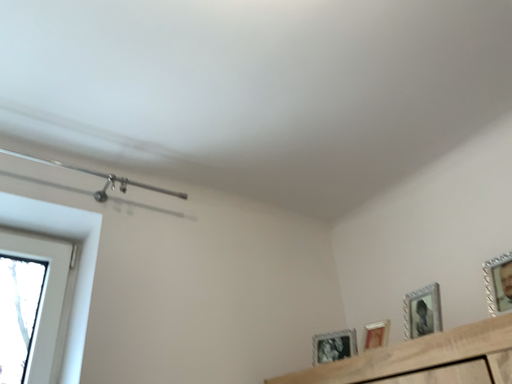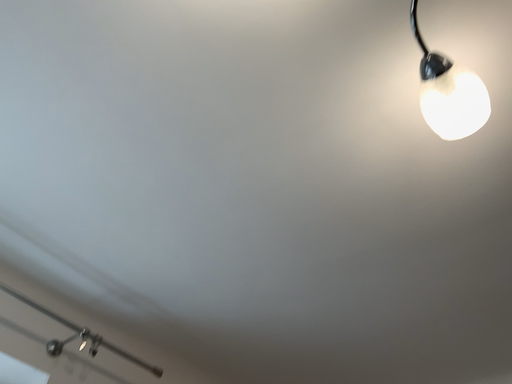
Question: How did the camera likely rotate when shooting the video?

Choices:
 (A) rotated upward
 (B) rotated downward

Answer: (A)